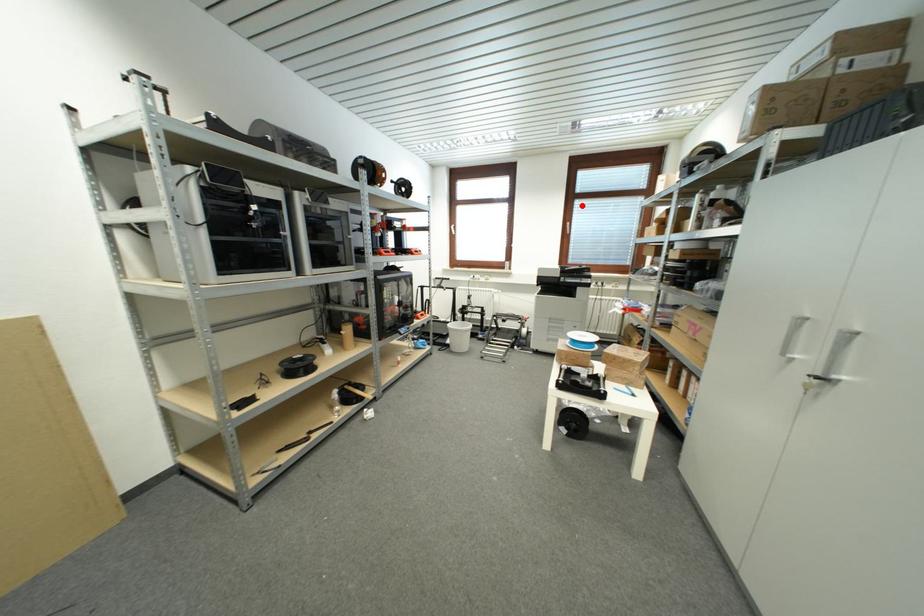
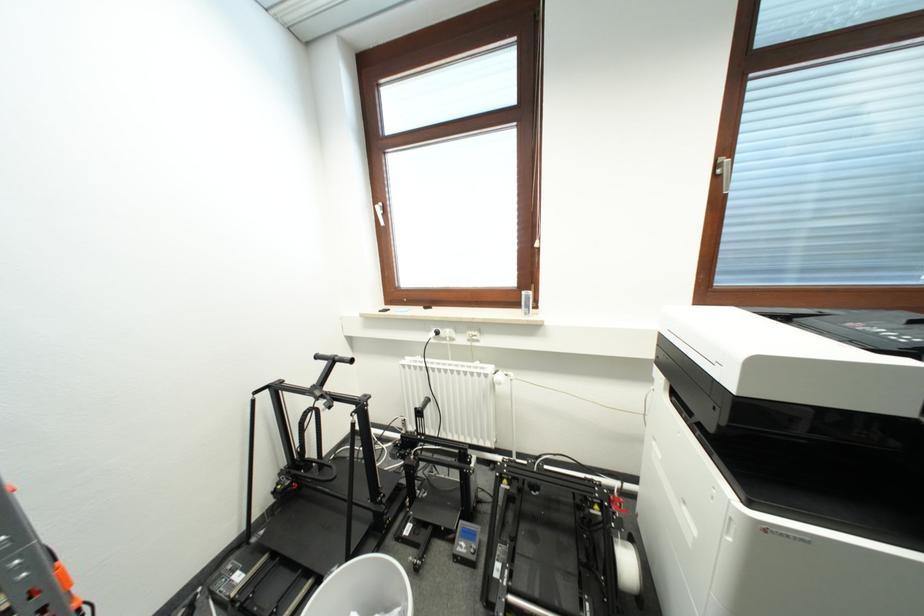
Question: A red point is marked in image1. In image2, is the corresponding 3D point closer to the camera or farther? Reply with the corresponding letter.

Choices:
 (A) The corresponding 3D point is closer.
 (B) The corresponding 3D point is farther.

Answer: (B)